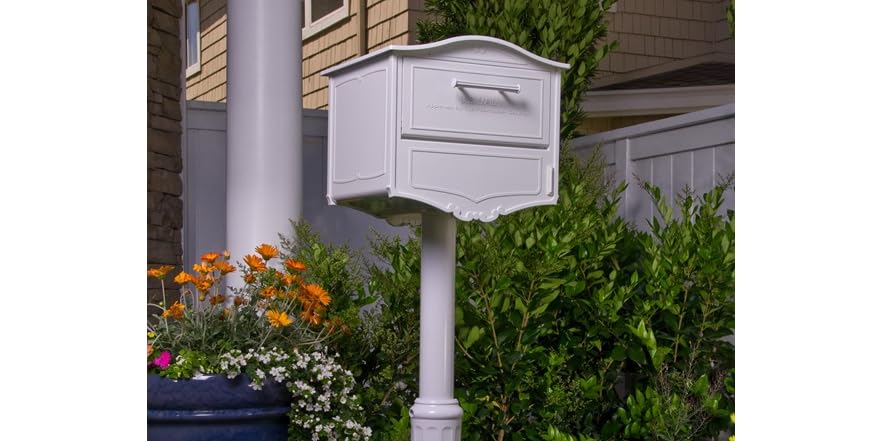
The width and height of the screenshot is (882, 441). Find the location of `handle`. handle is located at coordinates (475, 89).